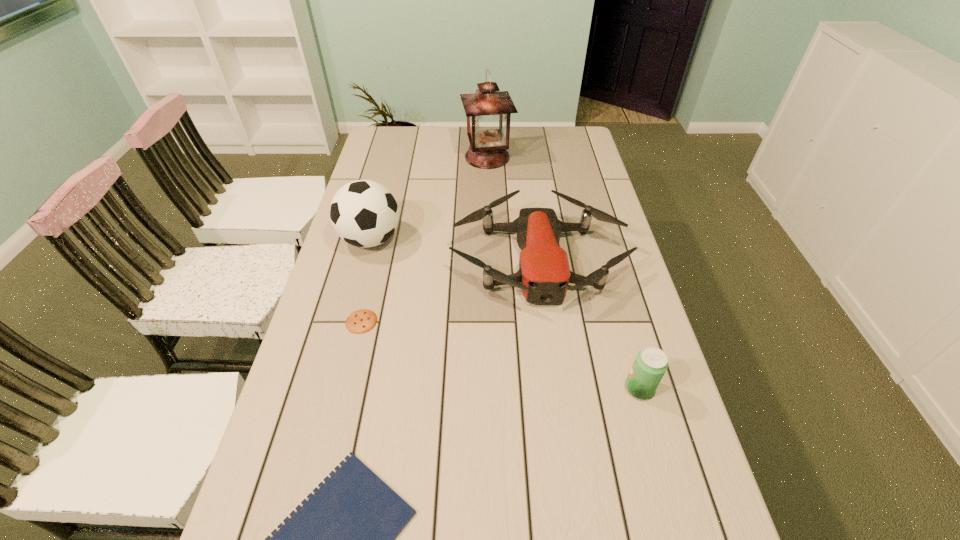
At what (x,y) coordinates should I click in order to perform the action: click on vacant position located 0.140m on the right of the cookie. Please return your answer as a coordinate pair (x, y). This screenshot has height=540, width=960. Looking at the image, I should click on (429, 321).

You are a GUI agent. You are given a task and a screenshot of the screen. Output one action in this format:
    pyautogui.click(x=<x>, y=<y>)
    Task: Click on the object at the far edge
    This screenshot has width=960, height=540.
    Given the screenshot: What is the action you would take?
    pyautogui.click(x=488, y=112)

The image size is (960, 540). In order to click on soccer ball at the left edge in this screenshot , I will do `click(364, 213)`.

The width and height of the screenshot is (960, 540). Find the location of `cookie present at the left edge`. cookie present at the left edge is located at coordinates (361, 321).

This screenshot has width=960, height=540. I want to click on soda present at the right edge, so click(650, 365).

I want to click on drone situated at the right edge, so click(x=544, y=274).

This screenshot has width=960, height=540. Find the location of `vacant region at the far edge of the desktop`. vacant region at the far edge of the desktop is located at coordinates (417, 135).

Locate an element on the screen. This screenshot has width=960, height=540. vacant space at the left edge is located at coordinates (308, 438).

Locate an element on the screen. The width and height of the screenshot is (960, 540). vacant space at the right edge of the desktop is located at coordinates 579,234.

In the image, there is a desktop. Identify the location of vacant space at the far left corner. The image size is (960, 540). (412, 126).